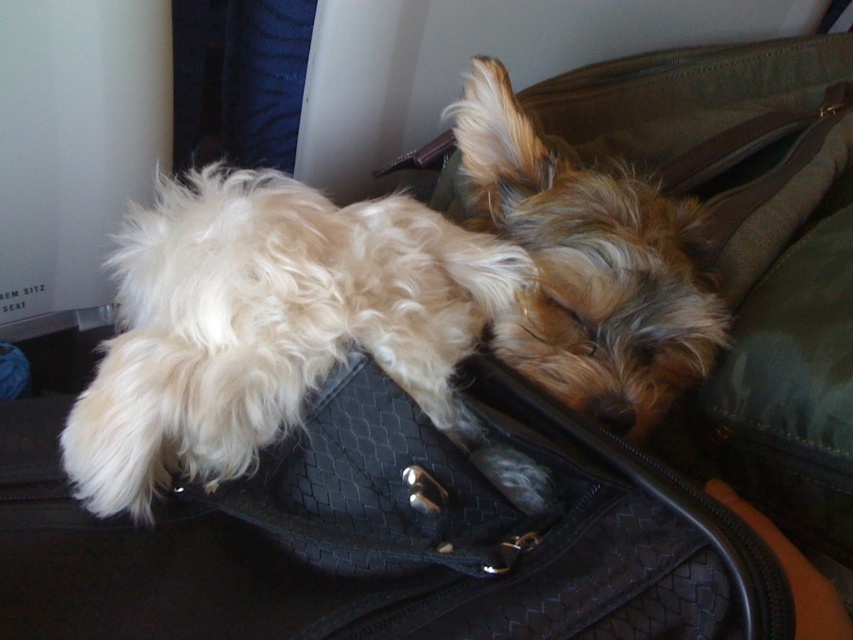
You are a photographer trying to capture both the white fluffy dog at center and the fuzzy brown dog at center in a single shot. Since you want to ensure both are in focus, which dog should you adjust your camera focus on first?

The white fluffy dog at center is closer to the viewer than the fuzzy brown dog at center. To ensure both are in focus, you should focus on the white fluffy dog at center first, as it is closer, and the depth of field will naturally include the fuzzy brown dog at center in the background.

You are a delivery person who needs to place a 24 inch long package between the white fluffy dog at center and the other dog. Can the package fit between them?

The distance between the white fluffy dog at center and the other dog is 24.18 inches. Since the package is 24 inches long, it can fit between them as there is enough space.

You are standing in front of the handbag and want to place a small sticker on the point that is closer to you. Which point should you choose between point (511, 477) and point (614, 188)?

Point (511, 477) is closer to the viewer than point (614, 188), so you should choose point (511, 477) to place the sticker.